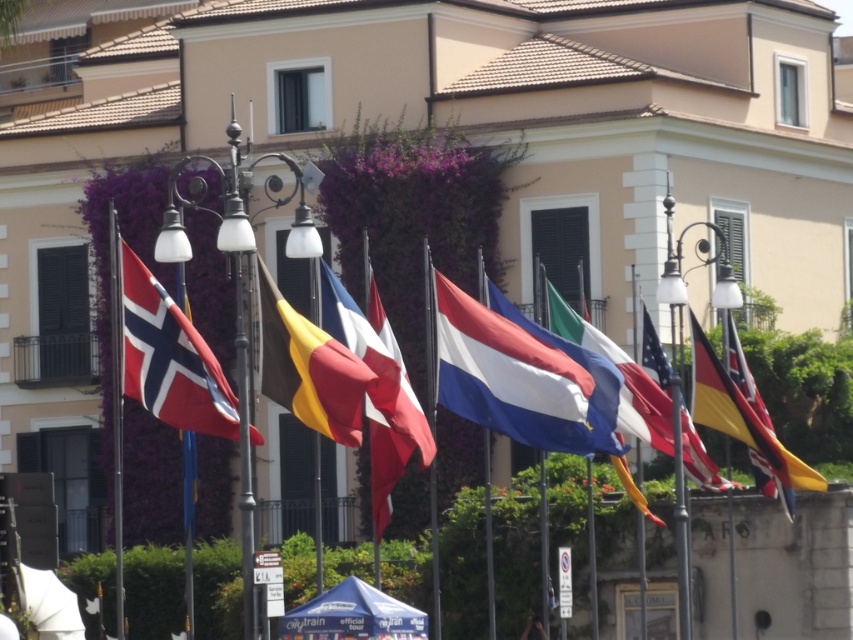
Question: Among these objects, which one is nearest to the camera?

Choices:
 (A) white fabric flag at center
 (B) yellow and black striped flag at center
 (C) metallic wrought iron streetlight at center

Answer: (A)

Question: Among these objects, which one is nearest to the camera?

Choices:
 (A) polished silver flag at right
 (B) red and white fabric flag at left
 (C) white cotton flag at center

Answer: (B)

Question: Estimate the real-world distances between objects in this image. Which object is farther from the yellow and black striped flag at center?

Choices:
 (A) polished silver flag at right
 (B) red and white fabric flag at left
 (C) red and white striped flag at center

Answer: (B)

Question: Observing the image, what is the correct spatial positioning of red and white fabric flag at left in reference to metallic wrought iron streetlight at center?

Choices:
 (A) left
 (B) right

Answer: (A)

Question: Can you confirm if white and blue fabric flag at center is positioned to the right of yellow and black striped flag at center?

Choices:
 (A) yes
 (B) no

Answer: (B)

Question: Is white fabric flag at center positioned in front of red and white striped flag at center?

Choices:
 (A) yes
 (B) no

Answer: (B)